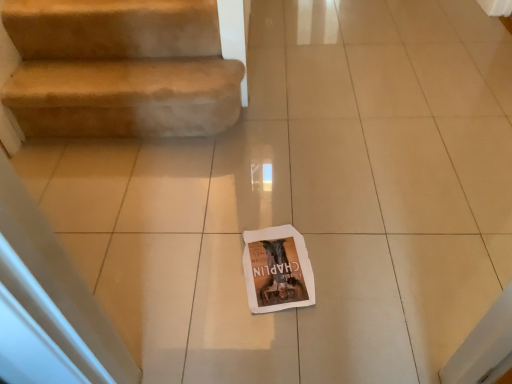
The height and width of the screenshot is (384, 512). I want to click on white paper at center, so click(x=277, y=269).

The image size is (512, 384). What do you see at coordinates (277, 269) in the screenshot? I see `white paper at center` at bounding box center [277, 269].

In order to face white paper at center, should I rotate leftwards or rightwards?

You should rotate right by 3.680 degrees.

The height and width of the screenshot is (384, 512). In order to click on white paper at center in this screenshot , I will do `click(277, 269)`.